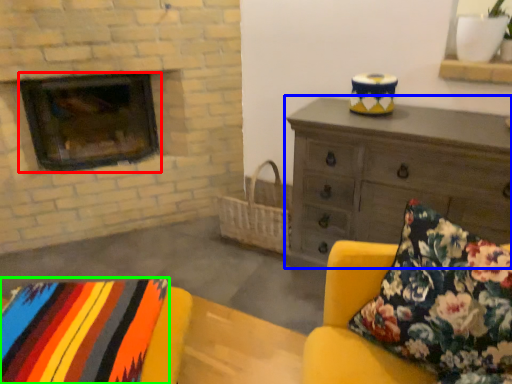
Question: Estimate the real-world distances between objects in this image. Which object is farther from wood burning stove (highlighted by a red box), chest of drawers (highlighted by a blue box) or blanket (highlighted by a green box)?

Choices:
 (A) chest of drawers
 (B) blanket

Answer: (B)